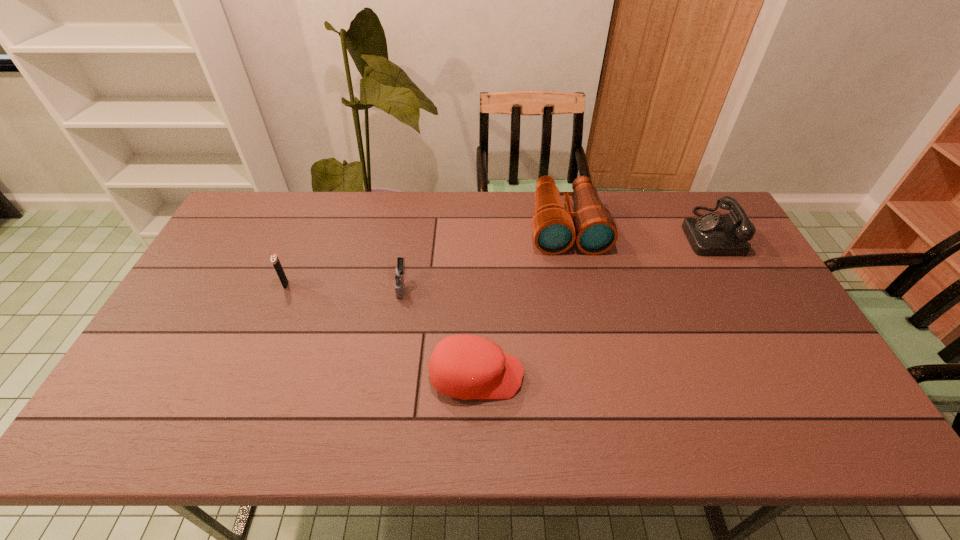
In the image, there is a desktop. Identify the location of vacant space at the right edge. (735, 320).

Where is `free space at the far left corner of the desktop`? Image resolution: width=960 pixels, height=540 pixels. free space at the far left corner of the desktop is located at coordinates (244, 226).

Identify the location of empty space between the telephone and the leftmost object. This screenshot has height=540, width=960. (497, 258).

Locate an element on the screen. free space between the nearest object and the telephone is located at coordinates (592, 304).

Locate an element on the screen. vacant region between the left igniter and the fourth object from left to right is located at coordinates click(426, 255).

I want to click on free space that is in between the fourth object from right to left and the left igniter, so click(x=344, y=285).

Where is `vacant space that is in between the second object from left to right and the telephone`? The height and width of the screenshot is (540, 960). vacant space that is in between the second object from left to right and the telephone is located at coordinates (556, 259).

Identify the location of free space between the cap and the second object from right to left. (x=521, y=301).

You are a GUI agent. You are given a task and a screenshot of the screen. Output one action in this format:
    pyautogui.click(x=<x>, y=<y>)
    Task: Click on the vacant area between the fourth object from right to left and the left igniter
    The image size is (960, 540).
    Given the screenshot: What is the action you would take?
    pyautogui.click(x=344, y=285)

Where is `empty space that is in between the leftmost object and the binoculars`? The height and width of the screenshot is (540, 960). empty space that is in between the leftmost object and the binoculars is located at coordinates (426, 255).